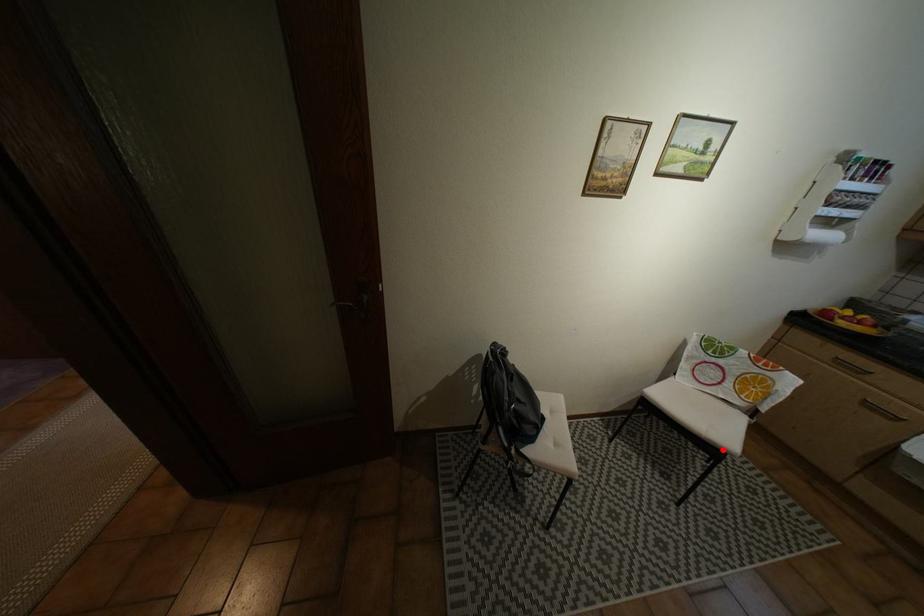
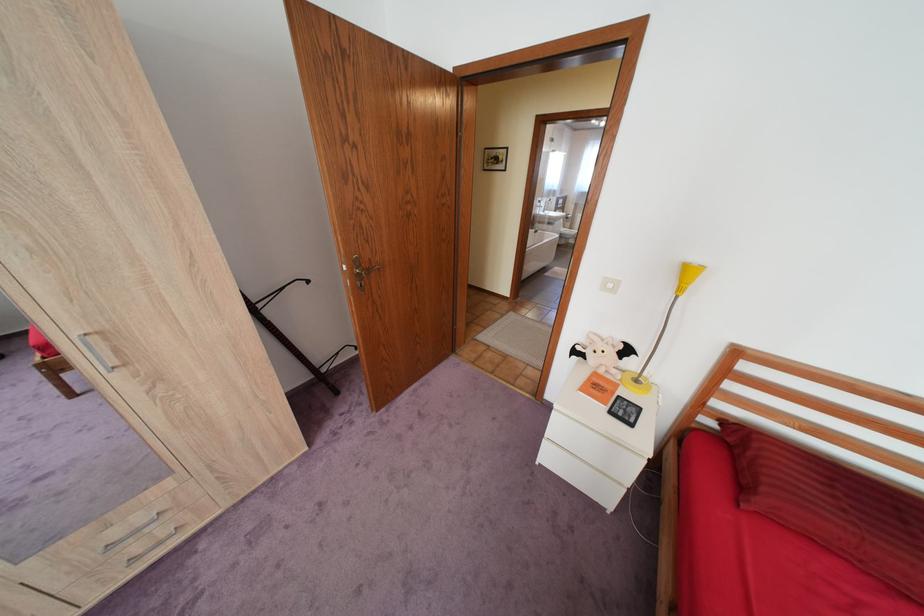
Question: I am providing you with two images of the same scene from different viewpoints. A red point is marked on the first image. At the location where the point appears in image 1, is it still visible in image 2?

Choices:
 (A) Yes
 (B) No

Answer: (B)